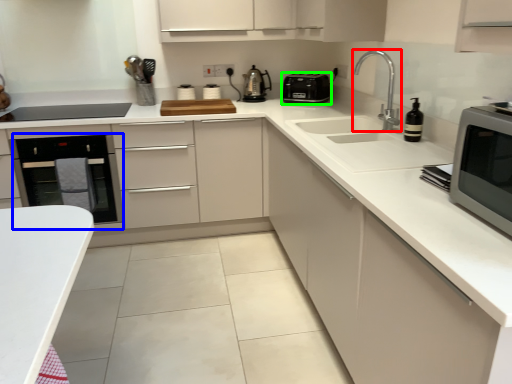
Question: Which object is positioned farthest from tap (highlighted by a red box)? Select from oven (highlighted by a blue box) and kitchen appliance (highlighted by a green box).

Choices:
 (A) oven
 (B) kitchen appliance

Answer: (A)